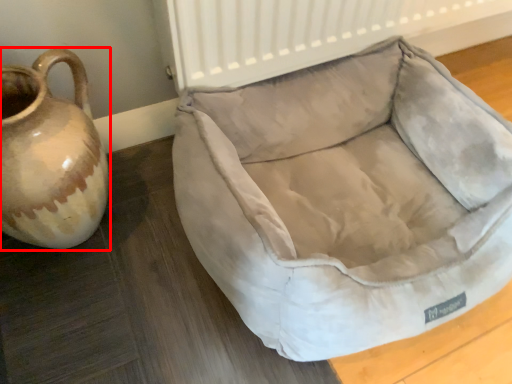
Question: From the image's perspective, where is jug (annotated by the red box) located relative to dog bed?

Choices:
 (A) above
 (B) below

Answer: (A)